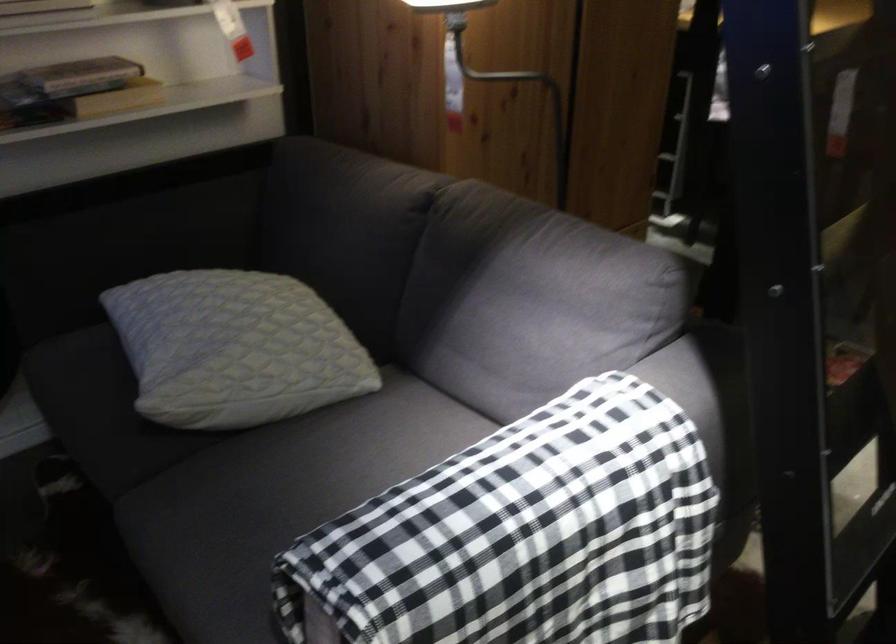
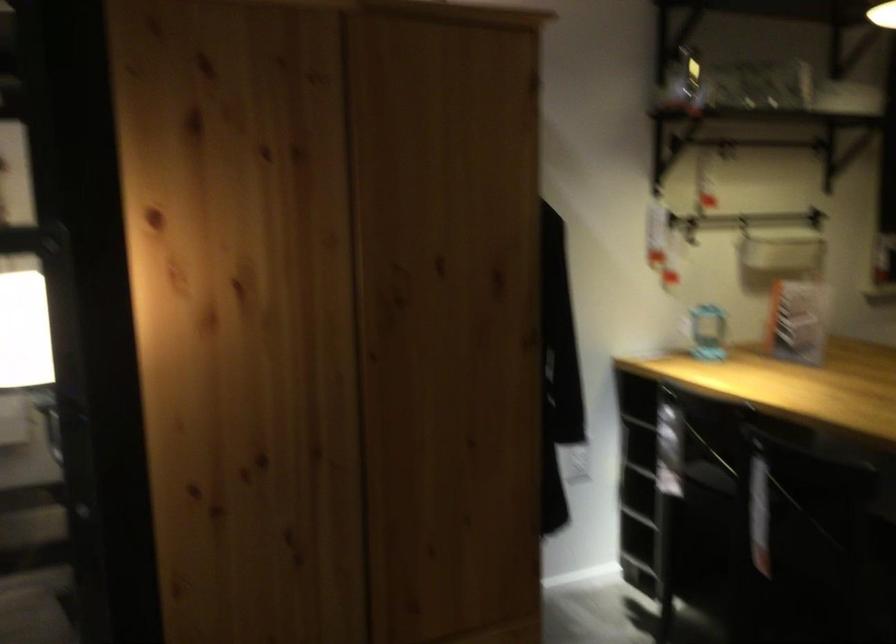
What movement of the cameraman would produce the second image?

A: The cameraman walked toward right, forward.